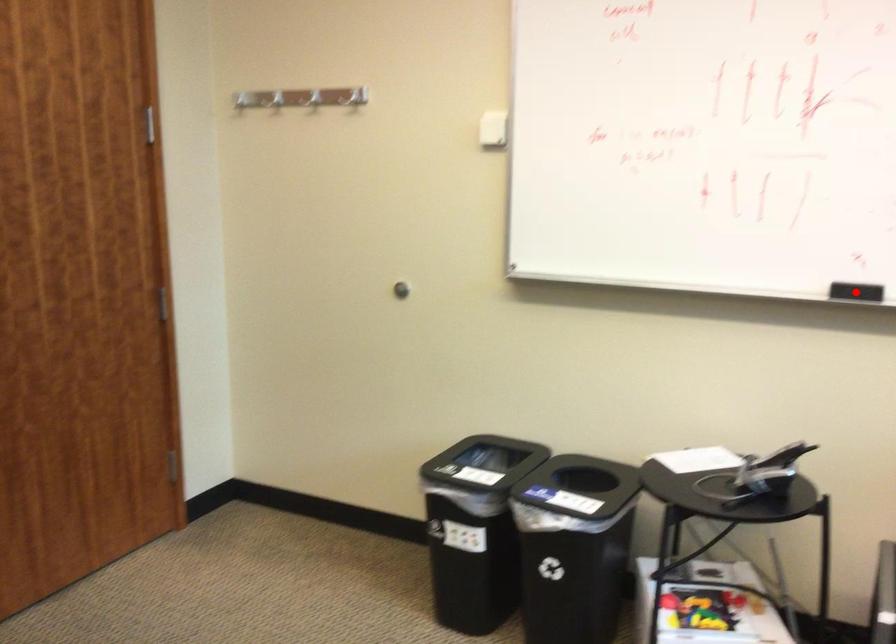
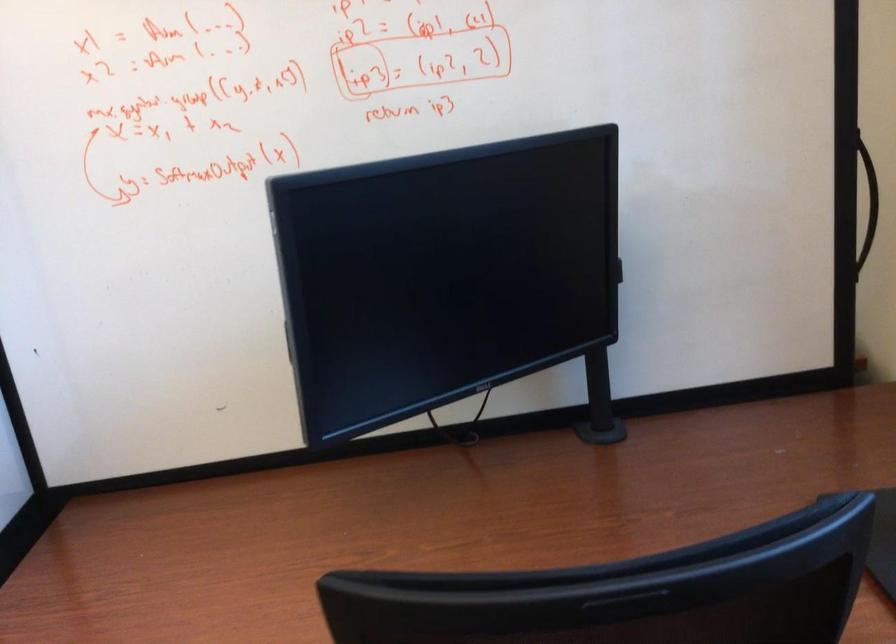
Question: I am providing you with two images of the same scene from different viewpoints. A red point is marked on the first image. Is the red point's position out of view in image 2?

Choices:
 (A) Yes
 (B) No

Answer: (A)